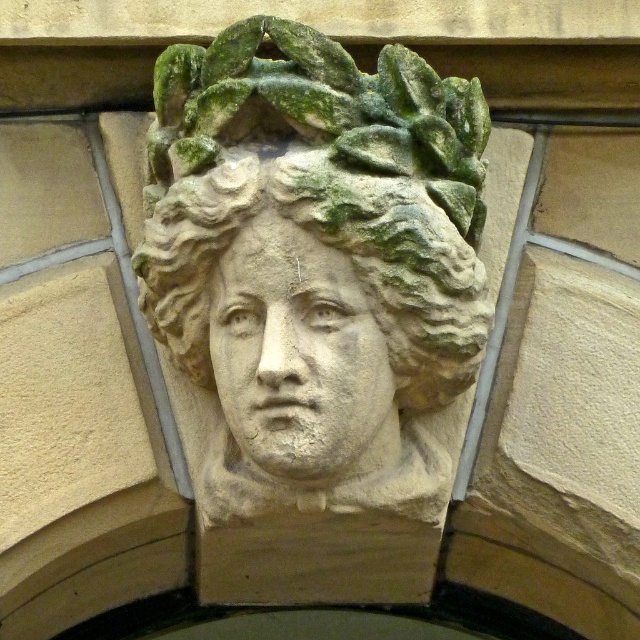
Question: Does stone sculpture at center have a greater width compared to stone face at center?

Choices:
 (A) no
 (B) yes

Answer: (B)

Question: Is stone sculpture at center bigger than stone face at center?

Choices:
 (A) no
 (B) yes

Answer: (B)

Question: Can you confirm if stone sculpture at center is smaller than stone face at center?

Choices:
 (A) no
 (B) yes

Answer: (A)

Question: Which object appears farthest from the camera in this image?

Choices:
 (A) stone sculpture at center
 (B) stone face at center

Answer: (A)

Question: Which of the following is the farthest from the observer?

Choices:
 (A) stone sculpture at center
 (B) stone face at center

Answer: (A)

Question: Which point is farther from the camera taking this photo?

Choices:
 (A) (406, 129)
 (B) (256, 282)

Answer: (A)